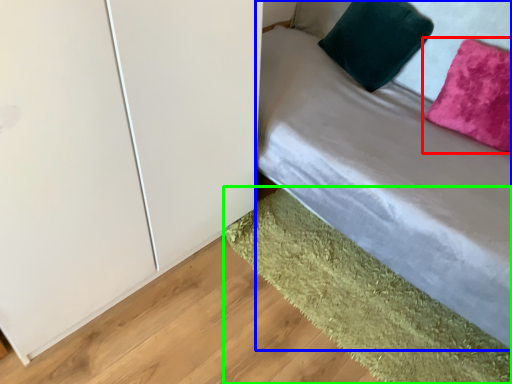
Question: Which object is positioned farthest from pillow (highlighted by a red box)? Select from bed (highlighted by a blue box) and mat (highlighted by a green box).

Choices:
 (A) bed
 (B) mat

Answer: (B)